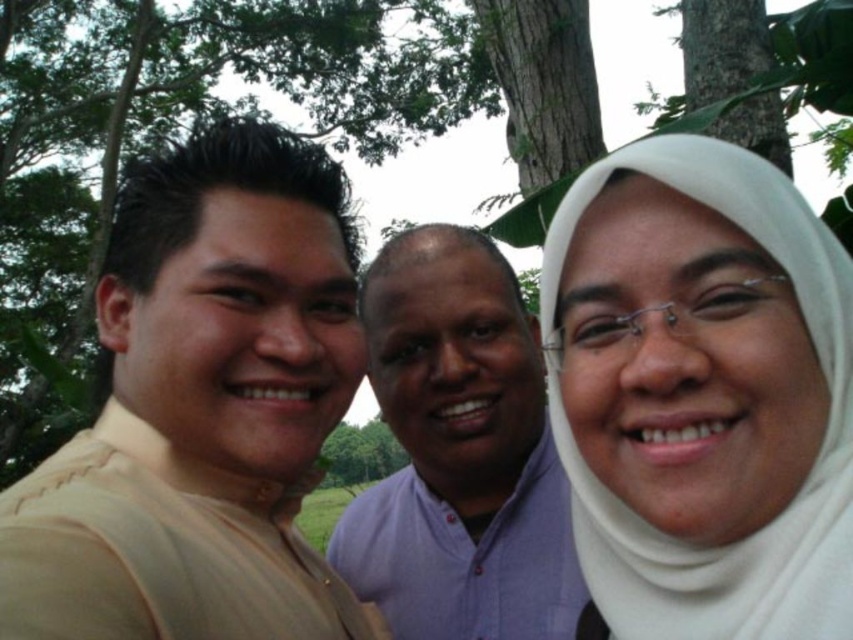
Question: Is green leafy tree at upper center positioned in front of purple cotton shirt at center?

Choices:
 (A) yes
 (B) no

Answer: (B)

Question: Which point is closer to the camera?

Choices:
 (A) (440, 387)
 (B) (727, 173)
 (C) (161, 122)
 (D) (33, 536)

Answer: (D)

Question: Which of the following is the closest to the observer?

Choices:
 (A) tap(585, 531)
 (B) tap(62, 292)

Answer: (A)

Question: Does beige fabric shirt at left lie in front of white matte hijab at center?

Choices:
 (A) yes
 (B) no

Answer: (A)

Question: Can you confirm if beige fabric shirt at left is positioned to the left of purple cotton shirt at center?

Choices:
 (A) no
 (B) yes

Answer: (B)

Question: Based on their relative distances, which object is farther from the white matte hijab at center?

Choices:
 (A) purple cotton shirt at center
 (B) beige fabric shirt at left

Answer: (A)